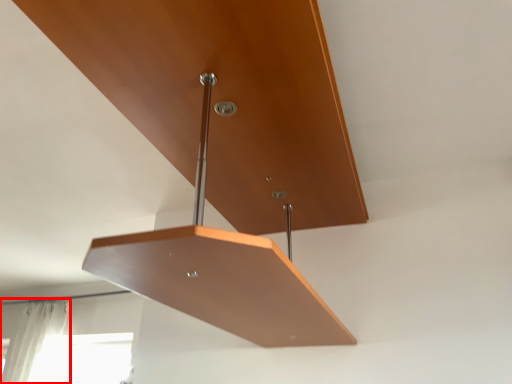
Question: Considering the relative positions of curtain (annotated by the red box) and furniture in the image provided, where is curtain (annotated by the red box) located with respect to the staircase?

Choices:
 (A) left
 (B) right

Answer: (A)